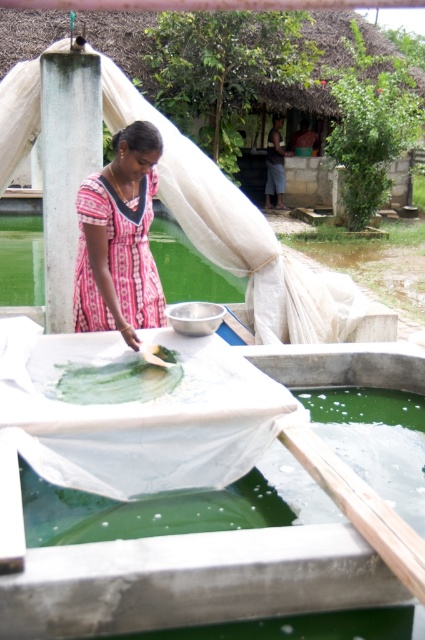
Which of these two, green translucent pool at lower center or green matte paint at center, stands shorter?

green matte paint at center

Who is taller, green translucent pool at lower center or green matte paint at center?

green translucent pool at lower center

Who is more forward, (223, 497) or (169, 365)?

Point (223, 497) is more forward.

Locate an element on the screen. Image resolution: width=425 pixels, height=640 pixels. green translucent pool at lower center is located at coordinates (172, 508).

Does pink printed dress at center appear under green matte paint at center?

Incorrect, pink printed dress at center is not positioned below green matte paint at center.

Is pink printed dress at center thinner than green matte paint at center?

Yes.

Identify the location of pink printed dress at center. (119, 240).

Between green translucent pool at lower center and pink printed dress at center, which one appears on the left side from the viewer's perspective?

pink printed dress at center is more to the left.

Is green translucent pool at lower center smaller than pink printed dress at center?

Actually, green translucent pool at lower center might be larger than pink printed dress at center.

Measure the distance between green translucent pool at lower center and camera.

green translucent pool at lower center and camera are 3.01 meters apart.

Find the location of a particular element. Image resolution: width=425 pixels, height=640 pixels. green translucent pool at lower center is located at coordinates (172, 508).